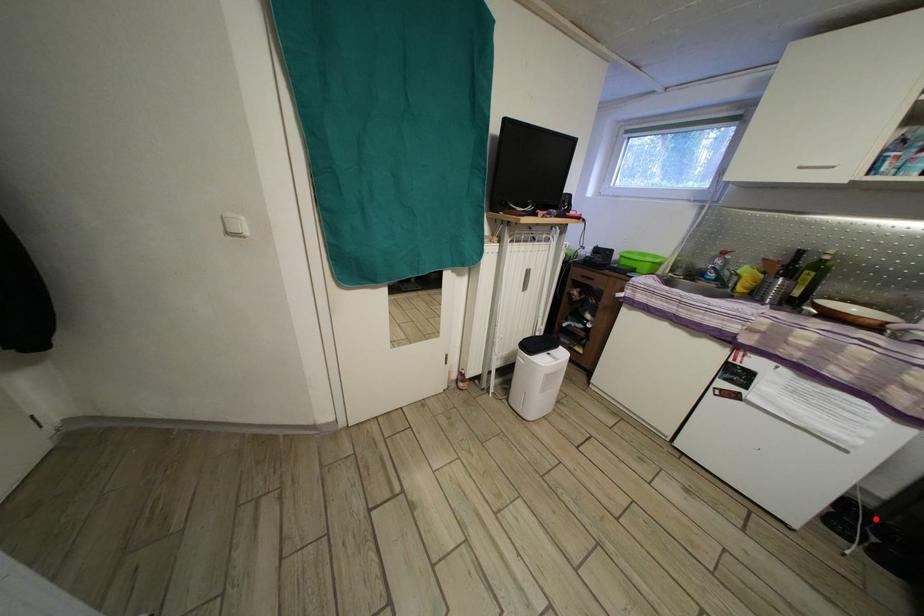
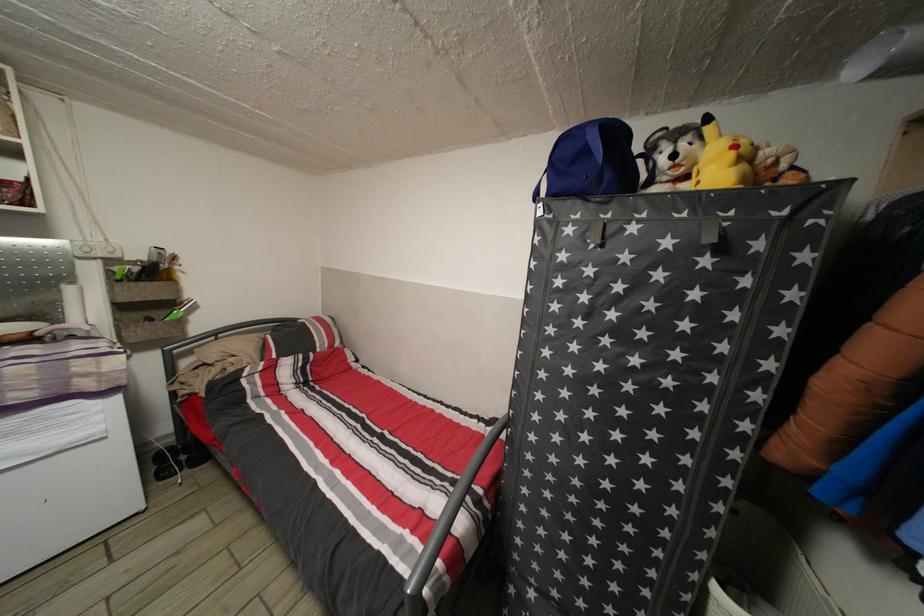
Question: A red point is marked in image1. In image2, is the corresponding 3D point closer to the camera or farther? Reply with the corresponding letter.

Choices:
 (A) The corresponding 3D point is closer.
 (B) The corresponding 3D point is farther.

Answer: (A)